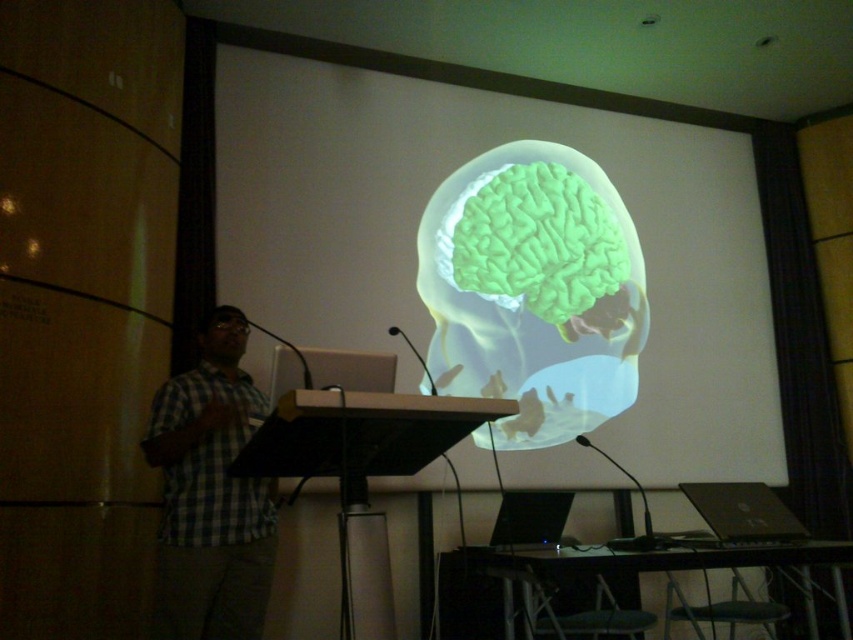
Between point (405, 330) and point (534, 531), which one is positioned behind?

The point (405, 330) is more distant.

Is transparent plastic brain at center to the right of black plastic laptop at lower center from the viewer's perspective?

Correct, you'll find transparent plastic brain at center to the right of black plastic laptop at lower center.

Is point (512, 106) closer to viewer compared to point (531, 528)?

No.

I want to click on transparent plastic brain at center, so click(x=421, y=212).

In order to click on transparent plastic brain at center in this screenshot , I will do `click(421, 212)`.

This screenshot has width=853, height=640. In order to click on transparent plastic brain at center in this screenshot , I will do `click(421, 212)`.

Which of these two, checkered fabric shirt at left or black plastic laptop at lower center, stands taller?

With more height is checkered fabric shirt at left.

Who is more forward, [227,387] or [517,541]?

Point [227,387]

I want to click on checkered fabric shirt at left, so click(x=210, y=493).